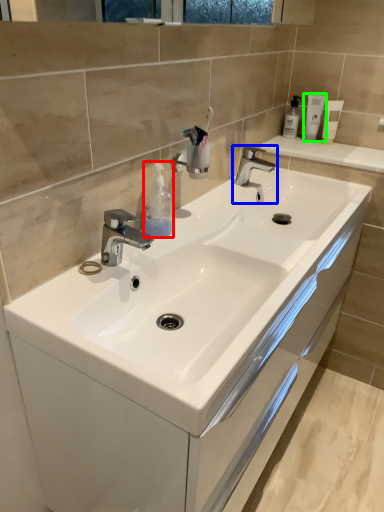
Question: Considering the real-world distances, which object is farthest from soap dispenser (highlighted by a red box)? tap (highlighted by a blue box) or mouthwash (highlighted by a green box)?

Choices:
 (A) tap
 (B) mouthwash

Answer: (B)